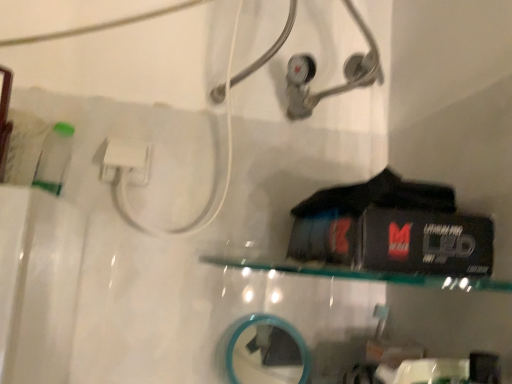
Question: Is teal glass mirror at lower center wider or thinner than clear glass shelf at center?

Choices:
 (A) thin
 (B) wide

Answer: (A)

Question: In terms of size, does teal glass mirror at lower center appear bigger or smaller than clear glass shelf at center?

Choices:
 (A) small
 (B) big

Answer: (A)

Question: From the image's perspective, relative to clear glass shelf at center, is teal glass mirror at lower center above or below?

Choices:
 (A) above
 (B) below

Answer: (B)

Question: Is clear glass shelf at center to the left or to the right of teal glass mirror at lower center in the image?

Choices:
 (A) left
 (B) right

Answer: (B)

Question: In the image, is clear glass shelf at center positioned in front of or behind teal glass mirror at lower center?

Choices:
 (A) behind
 (B) front

Answer: (B)

Question: In terms of height, does clear glass shelf at center look taller or shorter compared to teal glass mirror at lower center?

Choices:
 (A) short
 (B) tall

Answer: (A)

Question: Considering the positions of point click(468, 281) and point click(258, 357), is point click(468, 281) closer or farther from the camera than point click(258, 357)?

Choices:
 (A) closer
 (B) farther

Answer: (A)